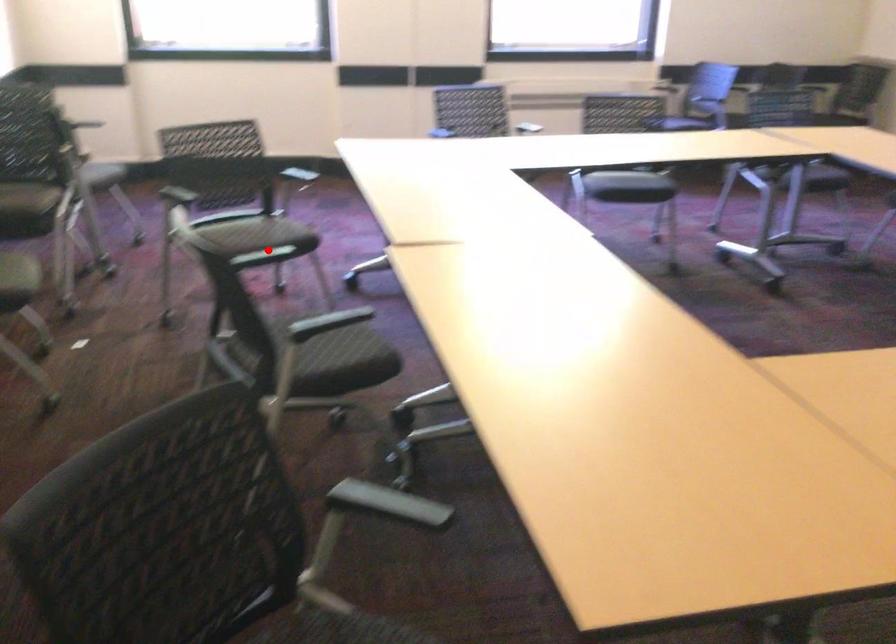
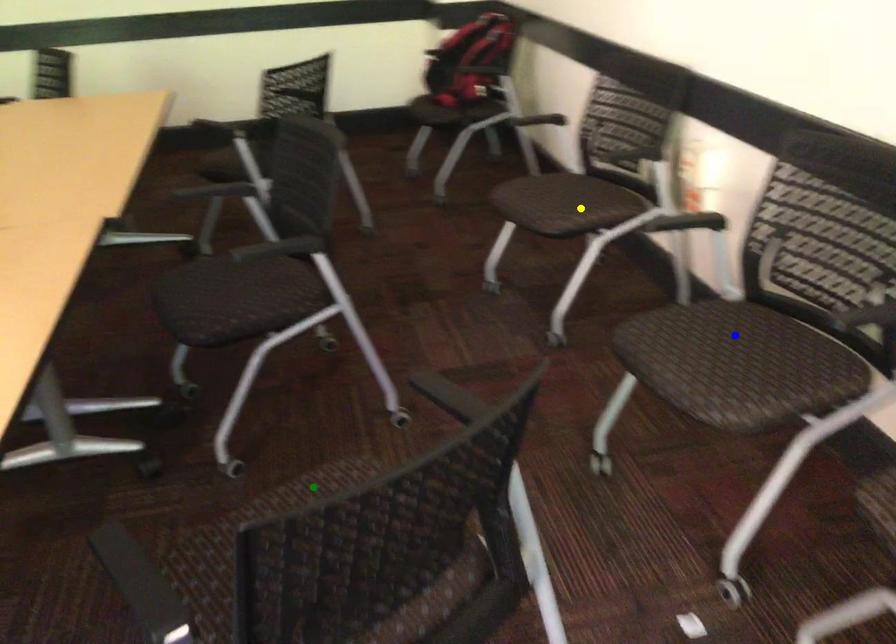
Question: I am providing you with two images of the same scene from different viewpoints. A red point is marked on the first image. You are given multiple points on the second image. Which mark in image 2 goes with the point in image 1?

Choices:
 (A) yellow point
 (B) green point
 (C) blue point

Answer: (B)